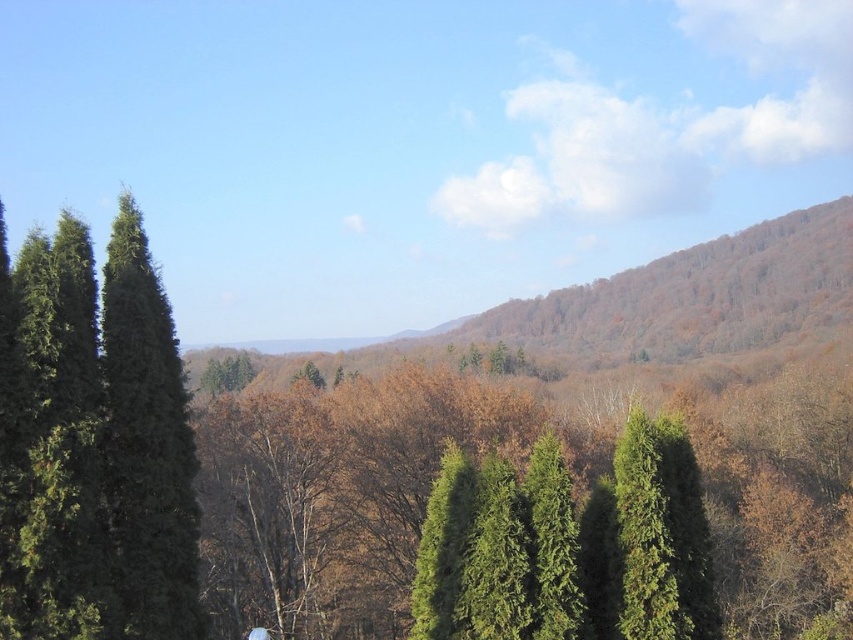
You are a hiker trying to navigate through the forest. You see the green textured trees at center and the green matte tree at left. Which tree would you need to look up higher to see the top of?

The green textured trees at center has a larger size compared to the green matte tree at left, so you would need to look up higher to see the top of the green textured trees at center.